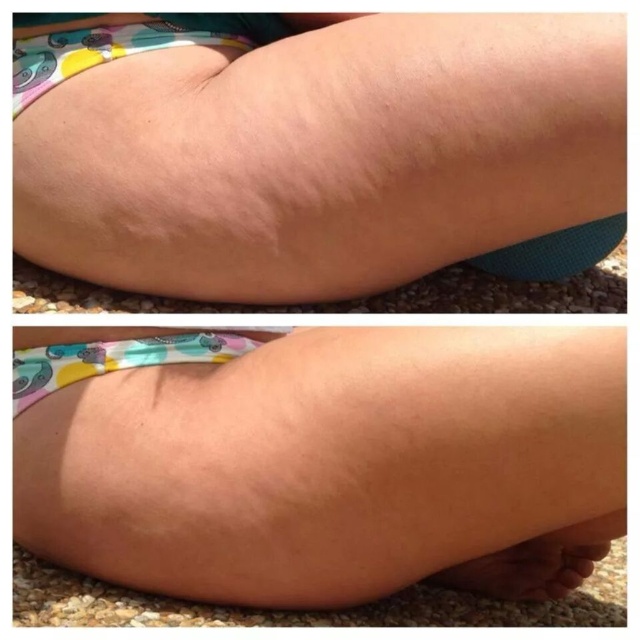
Question: Which object is the closest to the smooth skin at lower center?

Choices:
 (A) matte floral diaper at center
 (B) printed fabric diaper at upper left
 (C) smooth skin foot at lower center
 (D) smooth skin at center

Answer: (A)

Question: Does smooth skin at center appear on the left side of matte floral diaper at center?

Choices:
 (A) yes
 (B) no

Answer: (B)

Question: Is smooth skin at center below smooth skin at lower right?

Choices:
 (A) no
 (B) yes

Answer: (A)

Question: Based on their relative distances, which object is nearer to the smooth skin foot at lower center?

Choices:
 (A) matte floral diaper at center
 (B) smooth skin at lower right
 (C) printed fabric diaper at upper left

Answer: (B)

Question: In this image, where is smooth skin at center located relative to smooth skin foot at lower center?

Choices:
 (A) left
 (B) right

Answer: (A)

Question: Which object is positioned closest to the smooth skin foot at lower center?

Choices:
 (A) smooth skin at lower center
 (B) matte floral diaper at center
 (C) printed fabric diaper at upper left
 (D) brown matte toe at lower right

Answer: (D)